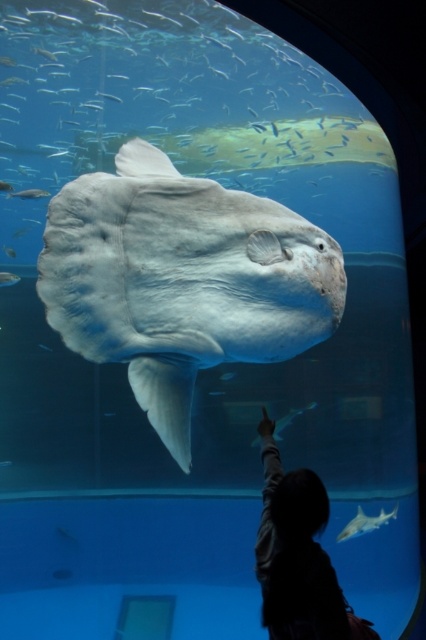
Question: Can you confirm if white smooth sunfish at center is bigger than smooth gray shark at center?

Choices:
 (A) yes
 (B) no

Answer: (A)

Question: Does silhouette fabric at lower center have a smaller size compared to translucent white fish at upper center?

Choices:
 (A) no
 (B) yes

Answer: (A)

Question: Estimate the real-world distances between objects in this image. Which object is closer to the translucent white fish at upper center?

Choices:
 (A) smooth gray shark at center
 (B) silhouette fabric at lower center

Answer: (B)

Question: Which point is closer to the camera?

Choices:
 (A) silhouette fabric at lower center
 (B) translucent white fish at upper center

Answer: (A)

Question: Considering the real-world distances, which object is farthest from the white smooth sunfish at center?

Choices:
 (A) silhouette fabric at lower center
 (B) smooth gray shark at center
 (C) translucent white fish at upper center

Answer: (B)

Question: Is white smooth sunfish at center further to camera compared to smooth gray shark at center?

Choices:
 (A) no
 (B) yes

Answer: (A)